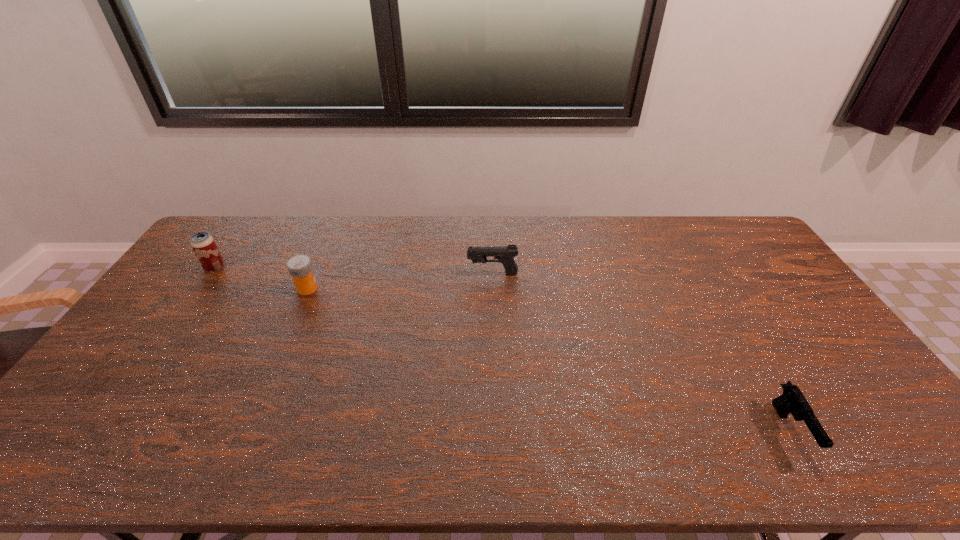
The height and width of the screenshot is (540, 960). In order to click on unoccupied area between the third object from left to right and the leftmost object in this screenshot , I will do `click(353, 271)`.

At what (x,y) coordinates should I click in order to perform the action: click on free space between the medicine and the second object from right to left. Please return your answer as a coordinate pair (x, y). This screenshot has width=960, height=540. Looking at the image, I should click on (400, 281).

This screenshot has height=540, width=960. I want to click on free point between the third object from left to right and the nearer pistol, so click(641, 352).

The height and width of the screenshot is (540, 960). I want to click on vacant area that lies between the right pistol and the leftmost object, so click(x=503, y=349).

Identify the location of free spot between the rightmost object and the farther pistol. (641, 352).

Identify the location of vacant area between the beer can and the second object from right to left. This screenshot has width=960, height=540. (353, 271).

Where is `blank region between the taller pistol and the nearer pistol`? Image resolution: width=960 pixels, height=540 pixels. blank region between the taller pistol and the nearer pistol is located at coordinates tap(641, 352).

Select which object appears as the second closest to the beer can. Please provide its 2D coordinates. Your answer should be formatted as a tuple, i.e. [(x, y)], where the tuple contains the x and y coordinates of a point satisfying the conditions above.

[(505, 254)]

This screenshot has height=540, width=960. What are the coordinates of `object that stands as the second closest to the beer can` in the screenshot? It's located at (505, 254).